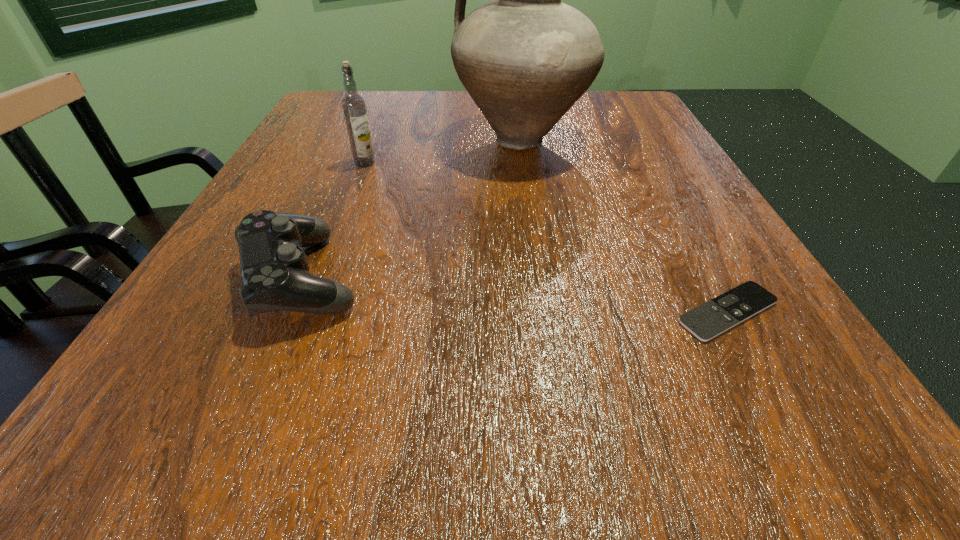
The height and width of the screenshot is (540, 960). In order to click on free space that satisfies the following two spatial constraints: 1. on the handle side of the shortest object; 2. on the left side of the tallest object in this screenshot , I will do `click(546, 312)`.